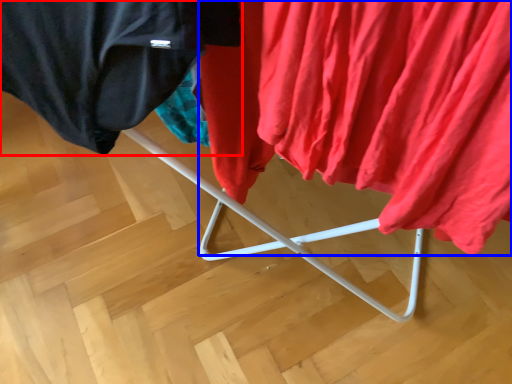
Question: Which object is closer to the camera taking this photo, cloak (highlighted by a red box) or curtain (highlighted by a blue box)?

Choices:
 (A) cloak
 (B) curtain

Answer: (B)